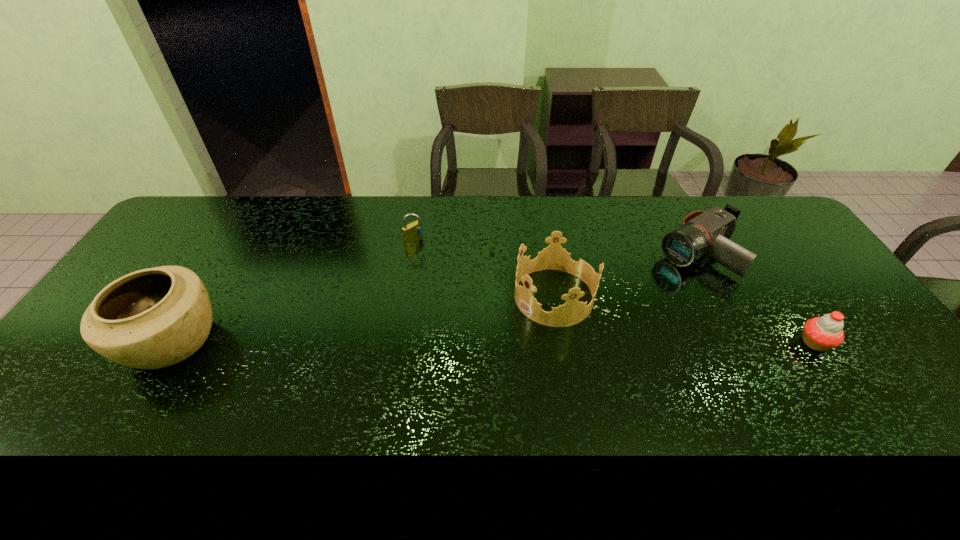
This screenshot has width=960, height=540. What are the coordinates of `object that is positioned at the near edge` in the screenshot? It's located at (153, 318).

Identify the location of object that is at the left edge. (153, 318).

This screenshot has height=540, width=960. What are the coordinates of `object that is at the right edge` in the screenshot? It's located at (822, 333).

Identify the location of object that is at the near left corner. This screenshot has width=960, height=540. (153, 318).

This screenshot has height=540, width=960. In order to click on vacant space at the far edge of the desktop in this screenshot , I will do `click(595, 228)`.

In the image, there is a desktop. At what (x,y) coordinates should I click in order to perform the action: click on vacant space at the near edge. Please return your answer as a coordinate pair (x, y). The width and height of the screenshot is (960, 540). Looking at the image, I should click on (727, 386).

This screenshot has height=540, width=960. Identify the location of vacant area at the far left corner. (215, 197).

Image resolution: width=960 pixels, height=540 pixels. Find the location of `blank space at the near left corner`. blank space at the near left corner is located at coordinates (89, 397).

Find the location of a particular element. The height and width of the screenshot is (540, 960). free region at the far right corner of the desktop is located at coordinates (775, 233).

Find the location of `vacant area that lies between the tiara and the leftmost object`. vacant area that lies between the tiara and the leftmost object is located at coordinates (363, 319).